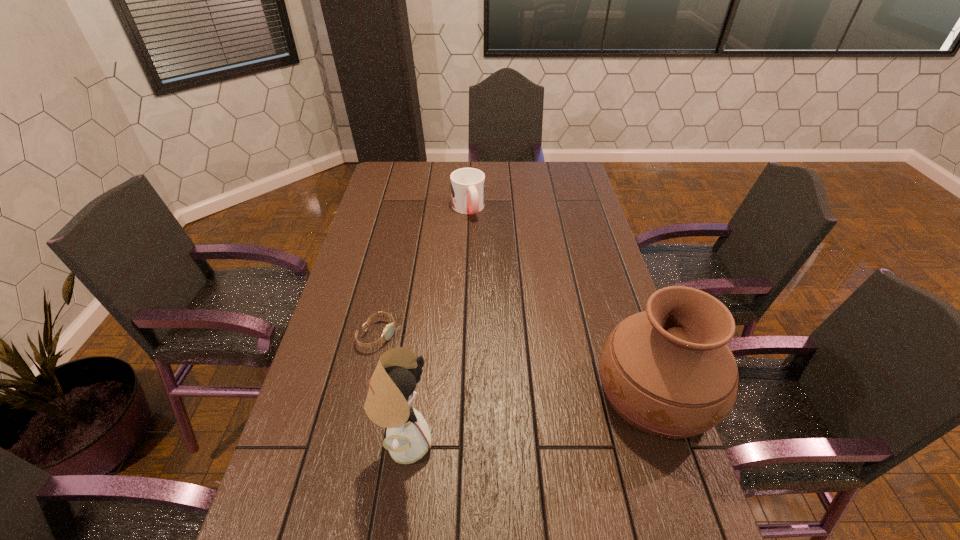
Locate an element on the screen. doll is located at coordinates (388, 404).

At what (x,y) coordinates should I click in order to perform the action: click on urn. Please return your answer as a coordinate pair (x, y). Image resolution: width=960 pixels, height=540 pixels. Looking at the image, I should click on (668, 371).

This screenshot has height=540, width=960. In order to click on the farthest object in this screenshot , I will do `click(467, 184)`.

Where is `the third tallest object`? the third tallest object is located at coordinates (467, 184).

Where is `watch`? This screenshot has width=960, height=540. watch is located at coordinates (388, 331).

What are the coordinates of `vacant space located 0.170m at the front face of the doll` in the screenshot? It's located at (505, 442).

This screenshot has height=540, width=960. I want to click on free space located on the left of the rightmost object, so click(x=513, y=392).

Find the location of a particular element. free space located on the side of the farthest object with the handle is located at coordinates (492, 268).

At what (x,y) coordinates should I click in order to perform the action: click on free location located on the side of the farthest object with the handle. Please return your answer as a coordinate pair (x, y). The height and width of the screenshot is (540, 960). Looking at the image, I should click on (498, 281).

Locate an element on the screen. This screenshot has height=540, width=960. blank space located 0.360m on the side of the farthest object with the handle is located at coordinates (499, 284).